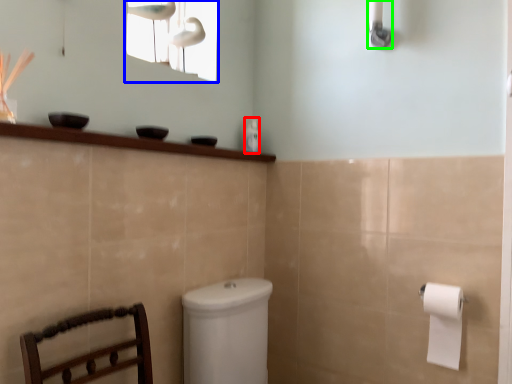
Question: Which object is the closest to the toiletry (highlighted by a red box)? Choose among these: window screen (highlighted by a blue box) or shower (highlighted by a green box).

Choices:
 (A) window screen
 (B) shower

Answer: (A)